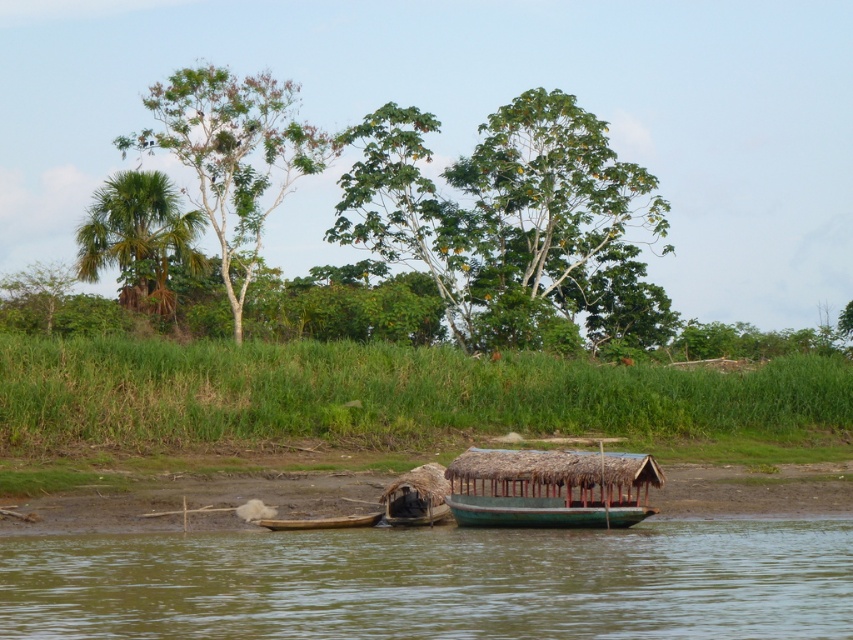
Question: Based on their relative distances, which object is farther from the green wooden boat at center?

Choices:
 (A) green matte boat at lower center
 (B) green leafy tree at upper left
 (C) green leafy tree at upper center
 (D) green leafy tree at center

Answer: (C)

Question: Which point is closer to the camera taking this photo?

Choices:
 (A) (201, 612)
 (B) (329, 518)

Answer: (A)

Question: Is green leafy tree at upper center above wooden boat at center?

Choices:
 (A) yes
 (B) no

Answer: (A)

Question: Does green grass at lower center come behind green wooden boat at center?

Choices:
 (A) no
 (B) yes

Answer: (B)

Question: Which point is farther to the camera?

Choices:
 (A) green wooden boat at center
 (B) green grass at lower center
 (C) green matte boat at lower center

Answer: (B)

Question: In this image, where is green leafy tree at upper center located relative to wooden canoe at lower left?

Choices:
 (A) left
 (B) right

Answer: (B)